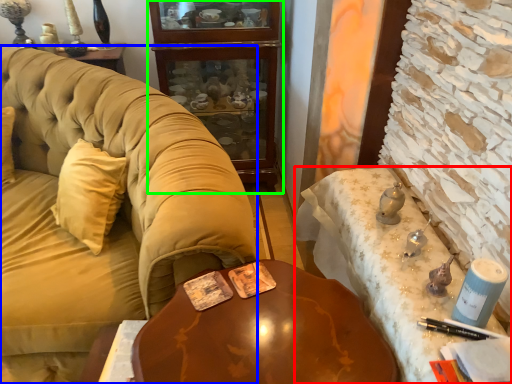
Question: Based on their relative distances, which object is nearer to desk (highlighted by a red box)? Choose from studio couch (highlighted by a blue box) and cabinetry (highlighted by a green box).

Choices:
 (A) studio couch
 (B) cabinetry

Answer: (A)